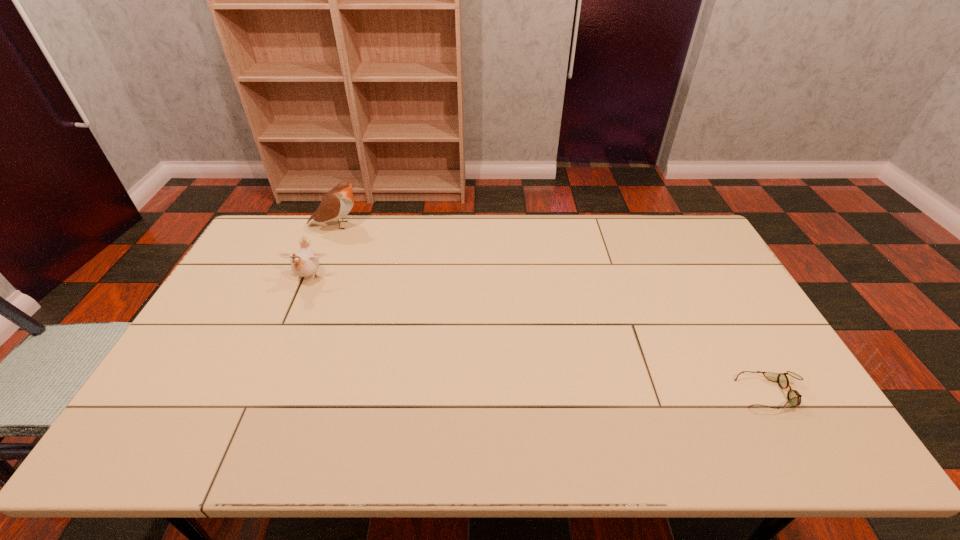
Locate an element on the screen. The height and width of the screenshot is (540, 960). blank space located on the front-facing side of the nearest object is located at coordinates 617,394.

Image resolution: width=960 pixels, height=540 pixels. In order to click on object that is at the far edge in this screenshot , I will do `click(337, 203)`.

This screenshot has width=960, height=540. Find the location of `object that is at the right edge`. object that is at the right edge is located at coordinates (794, 398).

I want to click on free space at the far edge of the desktop, so click(555, 247).

This screenshot has width=960, height=540. What are the coordinates of `free space at the near edge` in the screenshot? It's located at (739, 431).

I want to click on vacant space at the left edge of the desktop, so click(171, 392).

In the image, there is a desktop. Find the location of `vacant space at the far right corner`. vacant space at the far right corner is located at coordinates (650, 220).

Find the location of `unoccupied position between the spectacles and the taller bird`. unoccupied position between the spectacles and the taller bird is located at coordinates (554, 309).

You are a GUI agent. You are given a task and a screenshot of the screen. Output one action in this format:
    pyautogui.click(x=<x>, y=<y>)
    Task: Click on the vacant space that's between the second shortest object and the spectacles
    The width and height of the screenshot is (960, 540).
    Given the screenshot: What is the action you would take?
    pyautogui.click(x=540, y=336)

Locate an element on the screen. free spot between the rightmost object and the second nearest object is located at coordinates click(x=540, y=336).